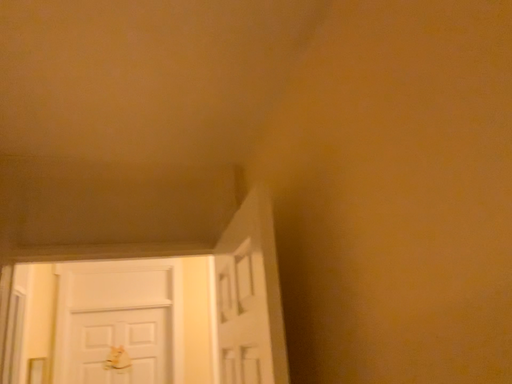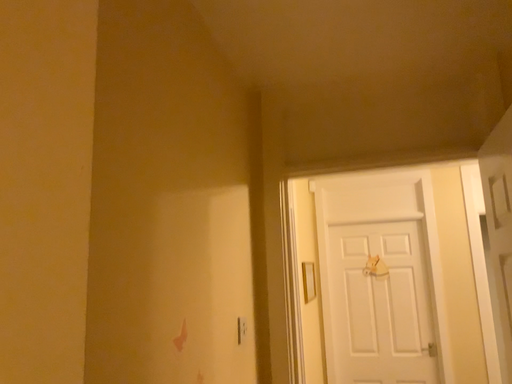
Question: How did the camera likely rotate when shooting the video?

Choices:
 (A) rotated left
 (B) rotated right

Answer: (A)